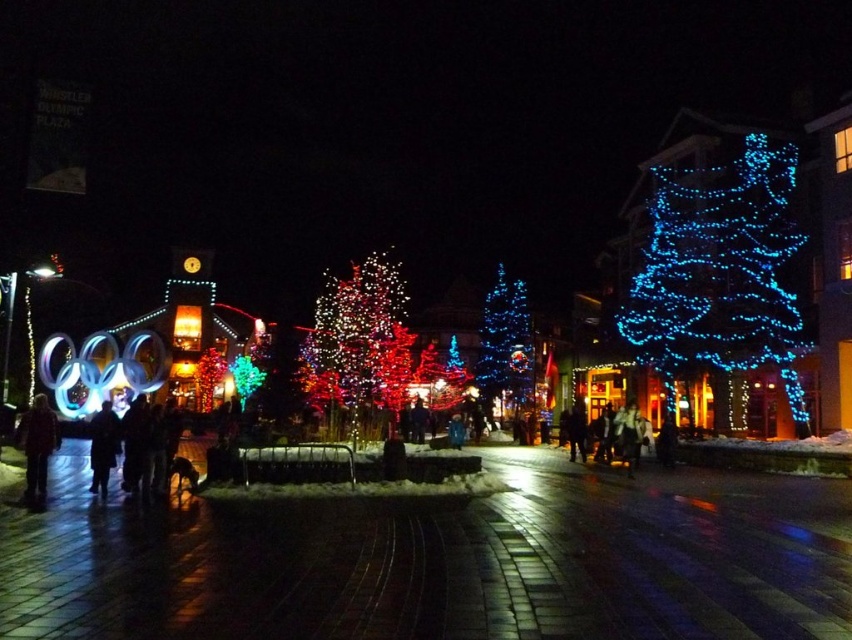
Question: Can you confirm if blue led lights at center is positioned below dark brown leather jacket at lower left?

Choices:
 (A) no
 (B) yes

Answer: (A)

Question: Estimate the real-world distances between objects in this image. Which object is farther from the dark brown coat at center?

Choices:
 (A) dark gray jacket at center
 (B) illuminated red tree at center
 (C) blue led lights at center

Answer: (C)

Question: Can you confirm if dark brown leather jacket at lower left is positioned above dark clothing at center?

Choices:
 (A) no
 (B) yes

Answer: (B)

Question: Which point is farther to the camera?

Choices:
 (A) dark clothing at center
 (B) dark brown coat at center

Answer: (A)

Question: Does brick pavement at center lie behind dark clothing at center?

Choices:
 (A) yes
 (B) no

Answer: (B)

Question: Which of the following is the farthest from the observer?

Choices:
 (A) illuminated red tree at center
 (B) dark brown coat at center
 (C) brick pavement at center

Answer: (A)